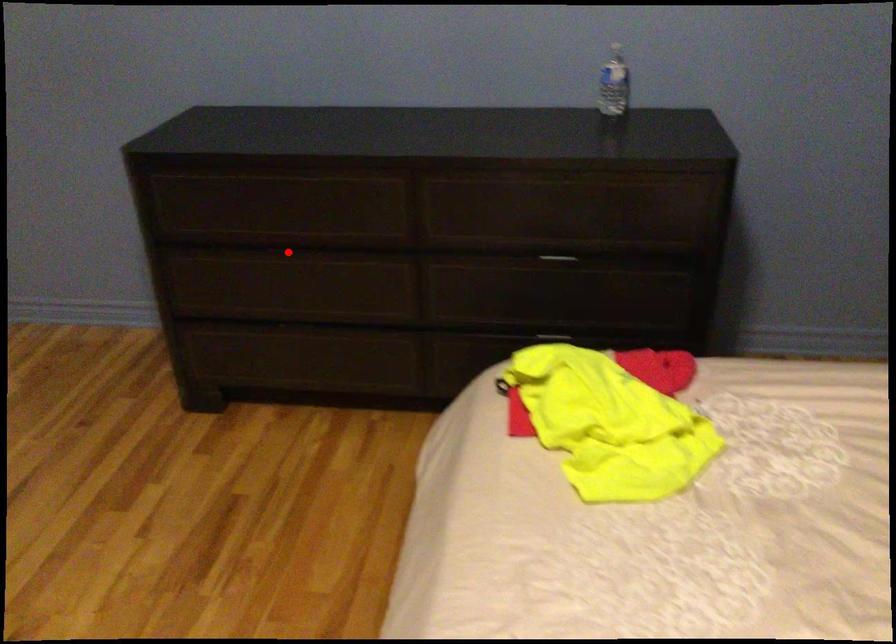
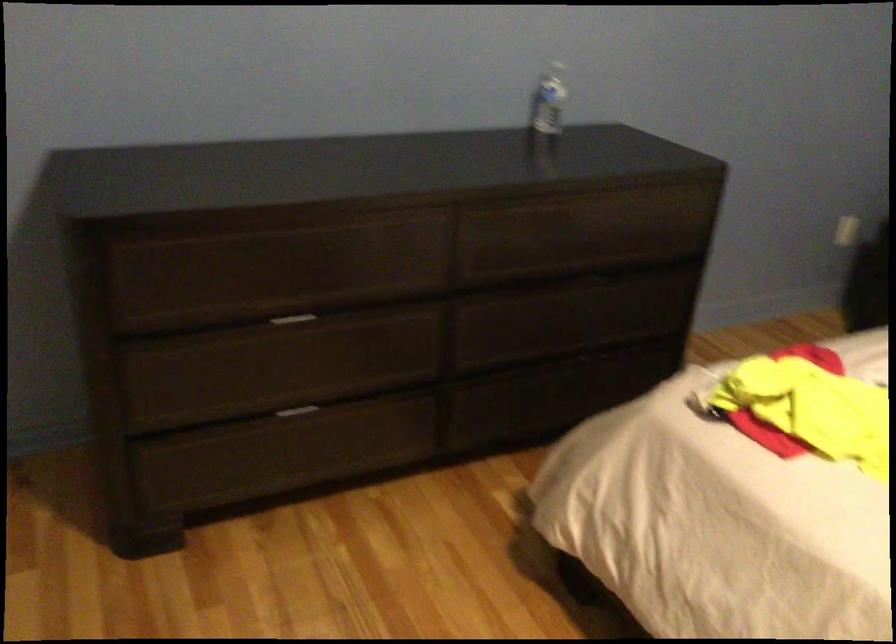
Question: A red point is marked in image1. In image2, is the corresponding 3D point closer to the camera or farther? Reply with the corresponding letter.

Choices:
 (A) The corresponding 3D point is closer.
 (B) The corresponding 3D point is farther.

Answer: (A)